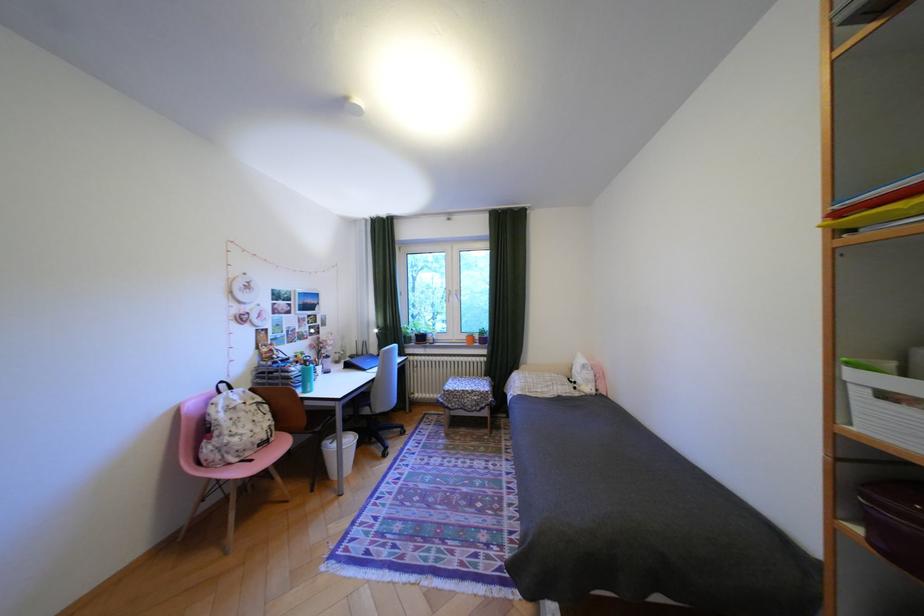
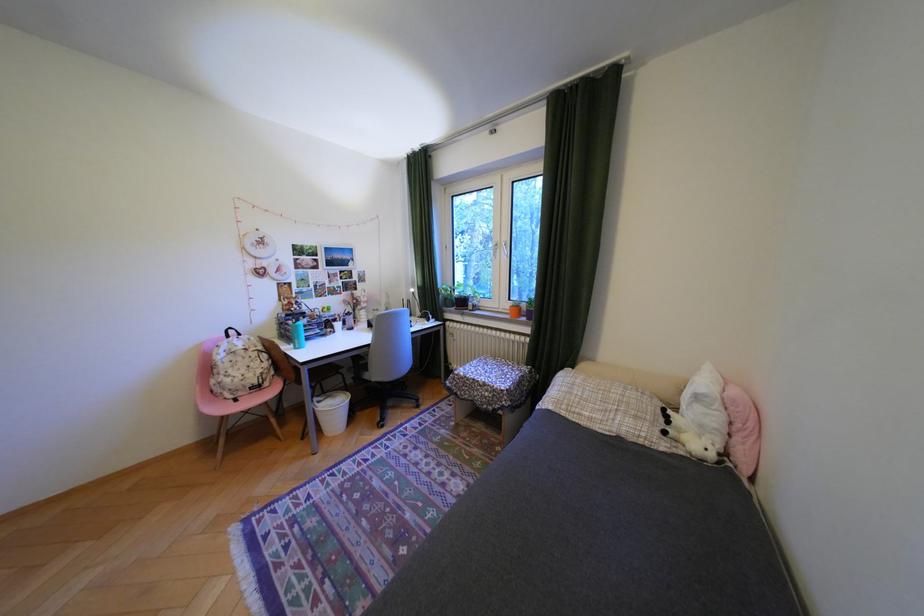
The point at (x=248, y=440) is marked in the first image. Where is the corresponding point in the second image?

(239, 379)